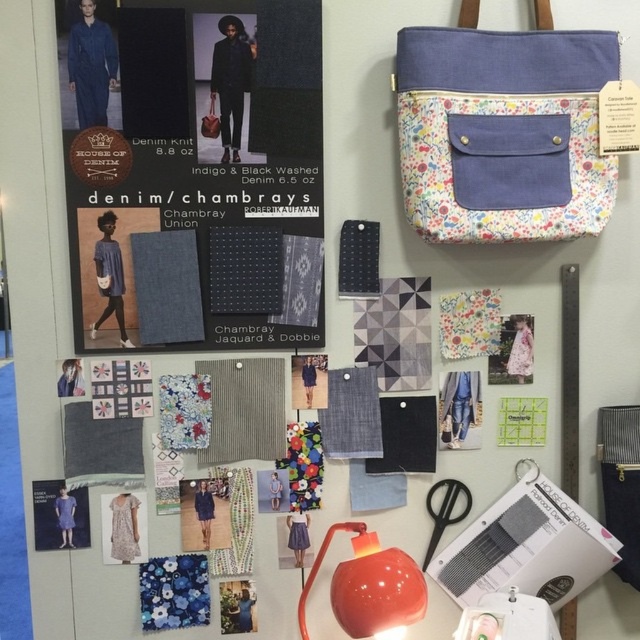
Question: Can you confirm if floral canvas tote at upper right is positioned below black plastic scissors at lower center?

Choices:
 (A) no
 (B) yes

Answer: (A)

Question: Can you confirm if denim knit at upper left is positioned to the left of leather-like textured bag at upper center?

Choices:
 (A) no
 (B) yes

Answer: (B)

Question: Can you confirm if denim knit at upper left is smaller than black plastic scissors at lower center?

Choices:
 (A) yes
 (B) no

Answer: (B)

Question: Which of the following is the closest to the observer?

Choices:
 (A) pos(573,161)
 (B) pos(339,528)

Answer: (A)

Question: Which object is positioned farthest from the denim knit at upper left?

Choices:
 (A) leather-like textured bag at upper center
 (B) orange glossy lamp at lower center
 (C) floral canvas tote at upper right
 (D) black plastic scissors at lower center

Answer: (D)

Question: Which point appears farthest from the camera in this image?

Choices:
 (A) (342, 596)
 (B) (248, 179)

Answer: (B)